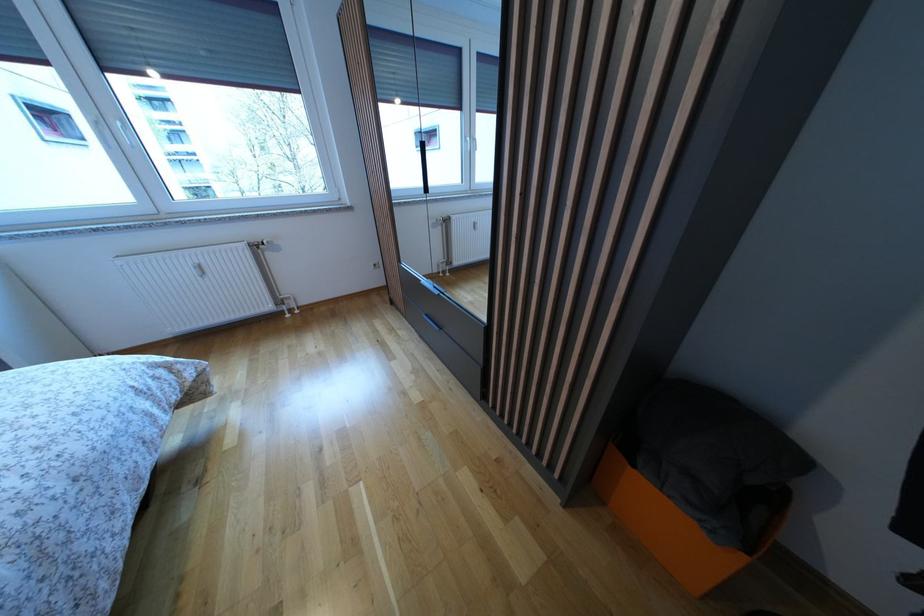
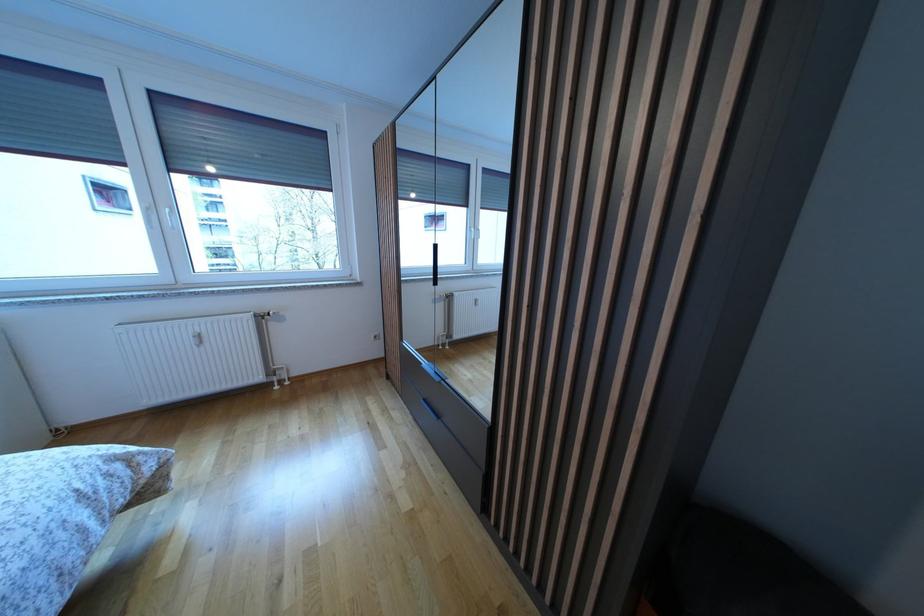
Question: The images are taken continuously from a first-person perspective. In which direction is your viewpoint rotating?

Choices:
 (A) Left
 (B) Right
 (C) Up
 (D) Down

Answer: (C)